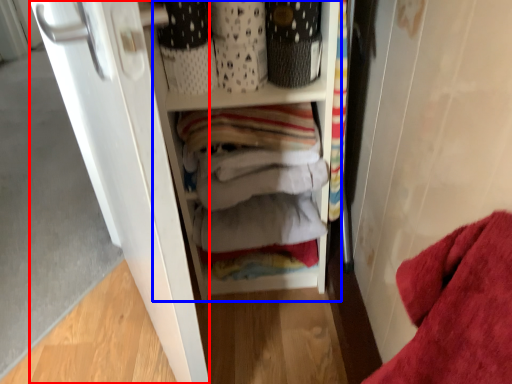
Question: Among these objects, which one is farthest to the camera, door (highlighted by a red box) or cabinetry (highlighted by a blue box)?

Choices:
 (A) door
 (B) cabinetry

Answer: (B)